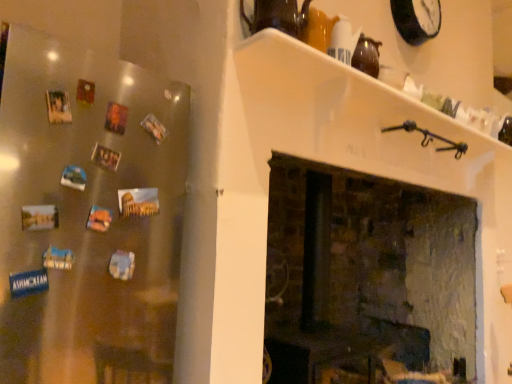
Question: Considering the relative positions of satin silver fridge magnets at left and matte brown teapot at upper center in the image provided, is satin silver fridge magnets at left to the left or to the right of matte brown teapot at upper center?

Choices:
 (A) right
 (B) left

Answer: (B)

Question: Would you say satin silver fridge magnets at left is inside or outside matte brown teapot at upper center?

Choices:
 (A) outside
 (B) inside

Answer: (A)

Question: Estimate the real-world distances between objects in this image. Which object is closer to the matte brown teapot at upper center?

Choices:
 (A) black plastic clock at upper right
 (B) white glossy shelf at upper center
 (C) satin silver fridge magnets at left
 (D) rustic brick fireplace at center

Answer: (B)

Question: Which object is positioned closest to the satin silver fridge magnets at left?

Choices:
 (A) matte brown teapot at upper center
 (B) black plastic clock at upper right
 (C) white glossy shelf at upper center
 (D) rustic brick fireplace at center

Answer: (C)